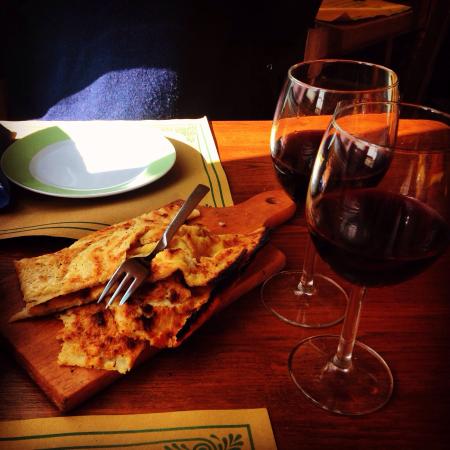
This screenshot has width=450, height=450. I want to click on this fork has only three tines, so click(139, 271).